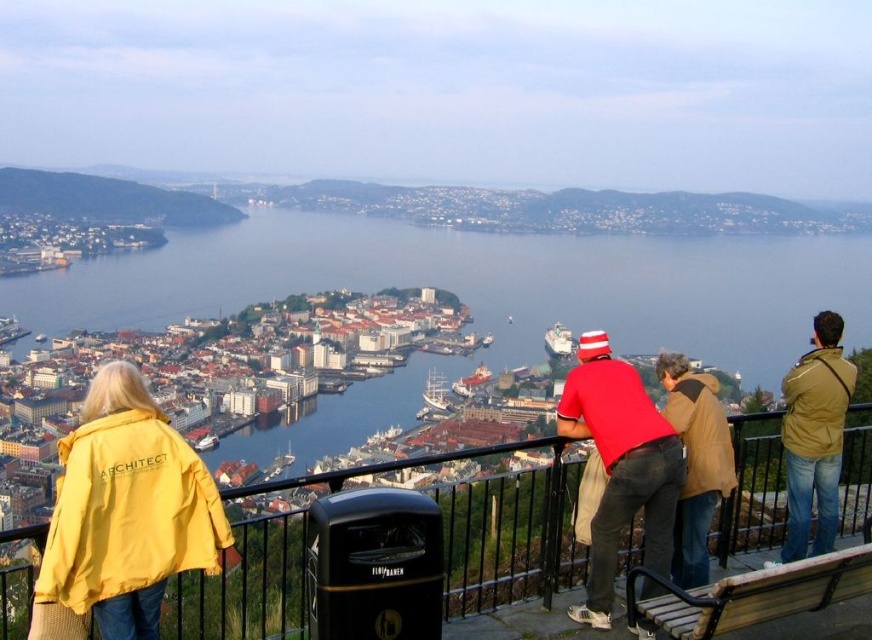
Which is behind, point (107, 618) or point (573, 380)?

The point (573, 380) is more distant.

Is yellow matte jacket at lower left to the right of red cotton shirt at center from the viewer's perspective?

Incorrect, yellow matte jacket at lower left is not on the right side of red cotton shirt at center.

Measure the distance between point (151,636) and camera.

Point (151,636) and camera are 275.19 meters apart from each other.

Where is `yellow matte jacket at lower left`? yellow matte jacket at lower left is located at coordinates point(128,509).

Measure the distance between yellow matte jacket at lower left and khaki cotton jacket at right.

yellow matte jacket at lower left is 222.39 meters away from khaki cotton jacket at right.

Between point (96, 456) and point (800, 372), which one is positioned in front?

Positioned in front is point (96, 456).

Between point (181, 461) and point (830, 365), which one is positioned behind?

Positioned behind is point (830, 365).

The image size is (872, 640). I want to click on yellow matte jacket at lower left, so click(x=128, y=509).

In the scene shown: Is brown leather jacket at center shorter than khaki cotton jacket at right?

In fact, brown leather jacket at center may be taller than khaki cotton jacket at right.

This screenshot has height=640, width=872. Identify the location of brown leather jacket at center. (695, 461).

Is point (690, 547) positioned behind point (828, 412)?

No.

The height and width of the screenshot is (640, 872). Identify the location of brown leather jacket at center. tap(695, 461).